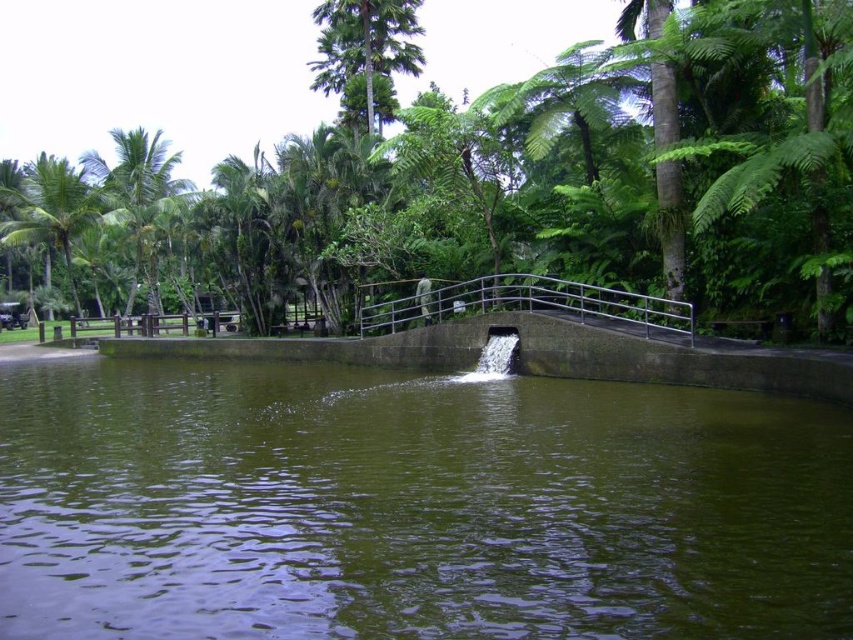
You are standing at the edge of the water feature and want to place a small decorative rock. You have two points marked in the scene, point 1 at coordinates point (x=442, y=298) and point 2 at point (x=39, y=241). Which point is closer to you where you can place the rock more visibly?

Point (x=442, y=298) is closer to the viewer than point (x=39, y=241), so placing the rock there would make it more visible.

You are standing at the edge of the water feature and want to place a small decorative rock at each of the two points labeled point [120,182] and point [39,212]. From your perspective, which point is closer to you?

Point [120,182] is in front of point [39,212], so it is closer to you.